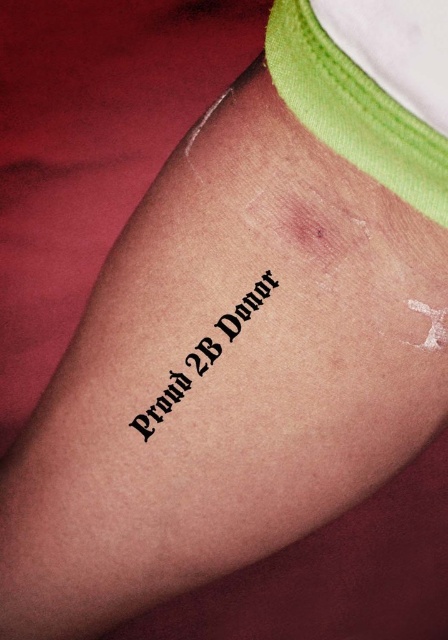
Question: In this image, where is white fabric at upper right located relative to black ink text at center?

Choices:
 (A) left
 (B) right

Answer: (B)

Question: Among these objects, which one is nearest to the camera?

Choices:
 (A) black ink text at center
 (B) white fabric at upper right

Answer: (B)

Question: Does white fabric at upper right have a smaller size compared to black ink text at center?

Choices:
 (A) no
 (B) yes

Answer: (A)

Question: Does white fabric at upper right appear on the right side of black ink text at center?

Choices:
 (A) yes
 (B) no

Answer: (A)